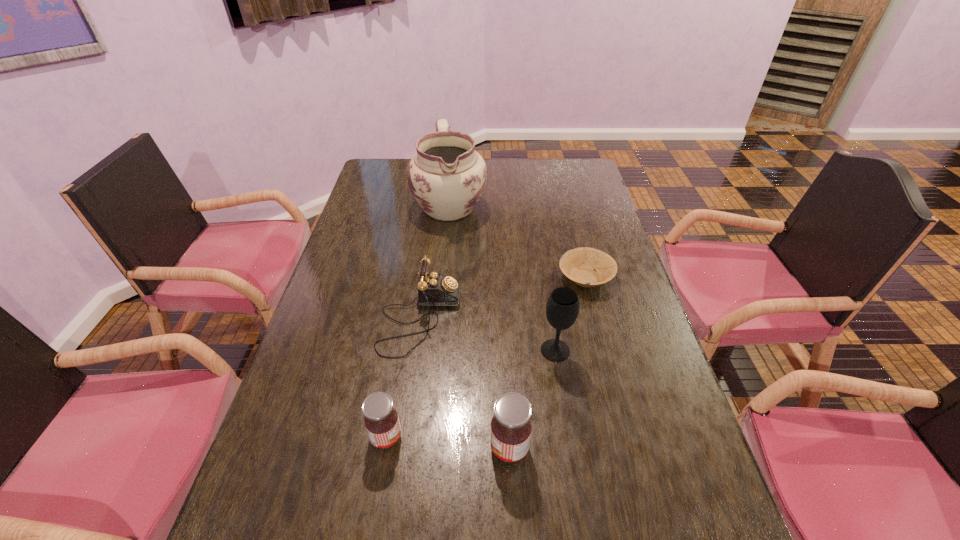
Please show where to add a jam on the right while keeping spacing even. Please provide its 2D coordinates. Your answer should be formatted as a tuple, i.e. [(x, y)], where the tuple contains the x and y coordinates of a point satisfying the conditions above.

[(637, 460)]